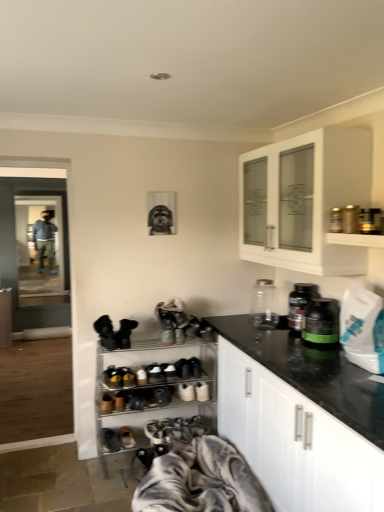
Locate an element on the screen. The height and width of the screenshot is (512, 384). space that is in front of transparent glass jar at right is located at coordinates (269, 334).